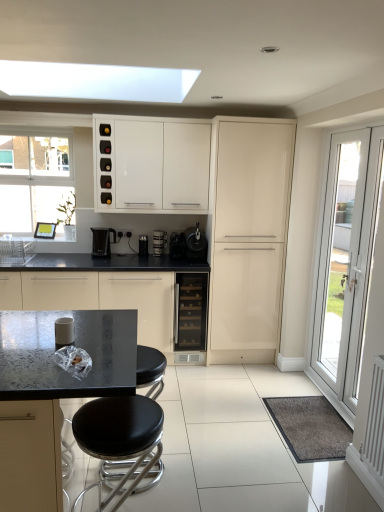
Image resolution: width=384 pixels, height=512 pixels. What do you see at coordinates (119, 438) in the screenshot?
I see `black leather stool at lower center` at bounding box center [119, 438].

Describe the element at coordinates (143, 245) in the screenshot. I see `metallic black coffee machine at center` at that location.

What do you see at coordinates (177, 246) in the screenshot?
I see `black plastic coffee machine at center, marked as the 2th coffee machine in a right-to-left arrangement` at bounding box center [177, 246].

Describe the element at coordinates (195, 244) in the screenshot. The image size is (384, 512). I see `satin black coffee machine at center, the fourth coffee machine in the left-to-right sequence` at that location.

Where is `glossy cream cabinet at center, marked as the 3th cabinetry in a left-to-right arrangement`? The height and width of the screenshot is (512, 384). glossy cream cabinet at center, marked as the 3th cabinetry in a left-to-right arrangement is located at coordinates (248, 236).

Who is taller, metallic black coffee machine at center or white glossy cabinet at upper center, marked as the second cabinetry in a right-to-left arrangement?

white glossy cabinet at upper center, marked as the second cabinetry in a right-to-left arrangement, is taller.

Is metallic black coffee machine at center positioned far away from white glossy cabinet at upper center, marked as the second cabinetry in a right-to-left arrangement?

Actually, metallic black coffee machine at center and white glossy cabinet at upper center, marked as the second cabinetry in a right-to-left arrangement, are a little close together.

Considering the relative sizes of metallic black coffee machine at center and white glossy cabinet at upper center, marked as the second cabinetry in a right-to-left arrangement, in the image provided, is metallic black coffee machine at center wider than white glossy cabinet at upper center, marked as the second cabinetry in a right-to-left arrangement,?

No, metallic black coffee machine at center is not wider than white glossy cabinet at upper center, marked as the second cabinetry in a right-to-left arrangement.

Where is `coffee machine that is the 1st one below the white glossy cabinet at upper center, which is the second cabinetry in left-to-right order (from a real-world perspective)`? coffee machine that is the 1st one below the white glossy cabinet at upper center, which is the second cabinetry in left-to-right order (from a real-world perspective) is located at coordinates (195, 244).

Considering the sizes of objects white glossy cabinet at upper center, marked as the second cabinetry in a right-to-left arrangement, and satin black coffee machine at center, acting as the 1th coffee machine starting from the right, in the image provided, who is shorter, white glossy cabinet at upper center, marked as the second cabinetry in a right-to-left arrangement, or satin black coffee machine at center, acting as the 1th coffee machine starting from the right,?

With less height is satin black coffee machine at center, acting as the 1th coffee machine starting from the right.

From the image's perspective, which object appears higher, white glossy cabinet at upper center, which is the second cabinetry in left-to-right order, or satin black coffee machine at center, the fourth coffee machine in the left-to-right sequence?

white glossy cabinet at upper center, which is the second cabinetry in left-to-right order, is shown above in the image.

From a real-world perspective, is white glossy cabinet at upper center, which is the second cabinetry in left-to-right order, on satin black coffee machine at center, acting as the 1th coffee machine starting from the right?

Yes.

From the picture: Does glossy cream cabinet at center, the first cabinetry in the right-to-left sequence, touch metallic black coffee machine at center?

No.

From the picture: Is glossy cream cabinet at center, the first cabinetry in the right-to-left sequence, oriented towards metallic black coffee machine at center?

No, glossy cream cabinet at center, the first cabinetry in the right-to-left sequence, is not aimed at metallic black coffee machine at center.

From the image's perspective, is glossy cream cabinet at center, marked as the 3th cabinetry in a left-to-right arrangement, positioned above or below metallic black coffee machine at center?

glossy cream cabinet at center, marked as the 3th cabinetry in a left-to-right arrangement, is above metallic black coffee machine at center.

Considering the points (238, 172) and (146, 252), which point is in front, point (238, 172) or point (146, 252)?

The point (238, 172) is more forward.

Is black leather stool at lower center situated inside satin black coffee machine at center, which ranks as the second coffee machine in left-to-right order, or outside?

A: black leather stool at lower center is not enclosed by satin black coffee machine at center, which ranks as the second coffee machine in left-to-right order.

Which is behind, point (142, 438) or point (162, 247)?

Point (162, 247)

From a real-world perspective, relative to satin black coffee machine at center, arranged as the 3th coffee machine when viewed from the right, is black leather stool at lower center vertically above or below?

black leather stool at lower center is situated lower than satin black coffee machine at center, arranged as the 3th coffee machine when viewed from the right, in the real world.

Can you tell me how much black leather stool at lower center and satin black coffee machine at center, which ranks as the second coffee machine in left-to-right order, differ in facing direction?

There is a 90-degree angle between the facing directions of black leather stool at lower center and satin black coffee machine at center, which ranks as the second coffee machine in left-to-right order.

From the image's perspective, would you say granite black table at center is shown under glossy cream cabinet at center, the first cabinetry in the right-to-left sequence?

Correct, granite black table at center appears lower than glossy cream cabinet at center, the first cabinetry in the right-to-left sequence, in the image.

Does point (63, 375) come behind point (251, 240)?

That is False.

Considering their positions, is granite black table at center located in front of or behind glossy cream cabinet at center, marked as the 3th cabinetry in a left-to-right arrangement?

Visually, granite black table at center is located in front of glossy cream cabinet at center, marked as the 3th cabinetry in a left-to-right arrangement.

Does granite black table at center have a larger size compared to glossy cream cabinet at center, marked as the 3th cabinetry in a left-to-right arrangement?

No, granite black table at center is not bigger than glossy cream cabinet at center, marked as the 3th cabinetry in a left-to-right arrangement.

What's the angular difference between matte black countertop at center, the 3th cabinetry when ordered from right to left, and black glass wine cooler at center's facing directions?

There is a 1.8-degree angle between the facing directions of matte black countertop at center, the 3th cabinetry when ordered from right to left, and black glass wine cooler at center.

From a real-world perspective, is matte black countertop at center, the first cabinetry in the left-to-right sequence, above or below black glass wine cooler at center?

From a real-world perspective, matte black countertop at center, the first cabinetry in the left-to-right sequence, is physically below black glass wine cooler at center.

Which object is wider, matte black countertop at center, the first cabinetry in the left-to-right sequence, or black glass wine cooler at center?

Wider between the two is black glass wine cooler at center.

Considering the relative sizes of matte black countertop at center, the first cabinetry in the left-to-right sequence, and black glass wine cooler at center in the image provided, is matte black countertop at center, the first cabinetry in the left-to-right sequence, bigger than black glass wine cooler at center?

Yes.

In the scene shown: Is white glossy door at right positioned in front of satin black coffee machine at center, which ranks as the second coffee machine in left-to-right order?

Yes, white glossy door at right is in front of satin black coffee machine at center, which ranks as the second coffee machine in left-to-right order.

Locate an element on the screen. The height and width of the screenshot is (512, 384). the 3rd coffee machine counting from the left of the white glossy door at right is located at coordinates (159, 242).

Is white glossy door at right to the right of satin black coffee machine at center, which ranks as the second coffee machine in left-to-right order, from the viewer's perspective?

Yes, white glossy door at right is to the right of satin black coffee machine at center, which ranks as the second coffee machine in left-to-right order.

Is point (328, 222) farther from camera compared to point (155, 233)?

No, it is not.

In order to click on cabinetry that is the 2nd object above the metallic black coffee machine at center (from a real-world perspective) in this screenshot , I will do `click(152, 165)`.

Where is `coffee machine that is the 3rd object to the right of the white glossy cabinet at upper center, marked as the second cabinetry in a right-to-left arrangement, starting at the anchor`? coffee machine that is the 3rd object to the right of the white glossy cabinet at upper center, marked as the second cabinetry in a right-to-left arrangement, starting at the anchor is located at coordinates tap(195, 244).

From the picture: Based on their spatial positions, is black plastic coffee machine at center, marked as the 3th coffee machine in a left-to-right arrangement, or matte black countertop at center, the 3th cabinetry when ordered from right to left, closer to satin black coffee machine at center, arranged as the 3th coffee machine when viewed from the right?

Based on the image, black plastic coffee machine at center, marked as the 3th coffee machine in a left-to-right arrangement, appears to be nearer to satin black coffee machine at center, arranged as the 3th coffee machine when viewed from the right.

From the image, which object appears to be farther from black glass wine cooler at center, black plastic coffee machine at center, which appears as the first coffee machine when viewed from the left, or white glossy cabinet at upper center, marked as the second cabinetry in a right-to-left arrangement?

Among the two, white glossy cabinet at upper center, marked as the second cabinetry in a right-to-left arrangement, is located further to black glass wine cooler at center.

Looking at the image, which one is located closer to white glossy cabinet at upper center, marked as the second cabinetry in a right-to-left arrangement, matte black countertop at center, the first cabinetry in the left-to-right sequence, or black glass wine cooler at center?

Based on the image, matte black countertop at center, the first cabinetry in the left-to-right sequence, appears to be nearer to white glossy cabinet at upper center, marked as the second cabinetry in a right-to-left arrangement.

When comparing their distances from black plastic coffee machine at center, which appears as the first coffee machine when viewed from the left, does metallic black coffee machine at center or glossy cream cabinet at center, marked as the 3th cabinetry in a left-to-right arrangement, seem further?

Based on the image, glossy cream cabinet at center, marked as the 3th cabinetry in a left-to-right arrangement, appears to be further to black plastic coffee machine at center, which appears as the first coffee machine when viewed from the left.

Looking at the image, which one is located closer to black leather stool at lower center, glossy cream cabinet at center, marked as the 3th cabinetry in a left-to-right arrangement, or white glossy cabinet at upper center, which is the second cabinetry in left-to-right order?

glossy cream cabinet at center, marked as the 3th cabinetry in a left-to-right arrangement.

From the image, which object appears to be nearer to white glossy cabinet at upper center, which is the second cabinetry in left-to-right order, black glass wine cooler at center or matte black countertop at center, the 3th cabinetry when ordered from right to left?

Based on the image, matte black countertop at center, the 3th cabinetry when ordered from right to left, appears to be nearer to white glossy cabinet at upper center, which is the second cabinetry in left-to-right order.

Based on their spatial positions, is black leather stool at lower center or black plastic coffee machine at center, which is the fourth coffee machine in right-to-left order, further from white glossy door at right?

black plastic coffee machine at center, which is the fourth coffee machine in right-to-left order, lies further to white glossy door at right than the other object.

Estimate the real-world distances between objects in this image. Which object is closer to glossy cream cabinet at center, the first cabinetry in the right-to-left sequence, black leather stool at lower center or satin black coffee machine at center, acting as the 1th coffee machine starting from the right?

satin black coffee machine at center, acting as the 1th coffee machine starting from the right, lies closer to glossy cream cabinet at center, the first cabinetry in the right-to-left sequence, than the other object.

Find the location of a particular element. Image resolution: width=384 pixels, height=512 pixels. coffee machine between black plastic coffee machine at center, marked as the 3th coffee machine in a left-to-right arrangement, and white glossy door at right is located at coordinates (195, 244).

Where is `round table between matte black countertop at center, the first cabinetry in the left-to-right sequence, and white glossy door at right`? Image resolution: width=384 pixels, height=512 pixels. round table between matte black countertop at center, the first cabinetry in the left-to-right sequence, and white glossy door at right is located at coordinates (52, 396).

This screenshot has height=512, width=384. In order to click on stool between granite black table at center and white glossy door at right from left to right in this screenshot , I will do `click(119, 438)`.

This screenshot has width=384, height=512. What are the coordinates of `appliance between black plastic coffee machine at center, which appears as the first coffee machine when viewed from the left, and black plastic coffee machine at center, marked as the 3th coffee machine in a left-to-right arrangement, in the horizontal direction` in the screenshot? It's located at (143, 245).